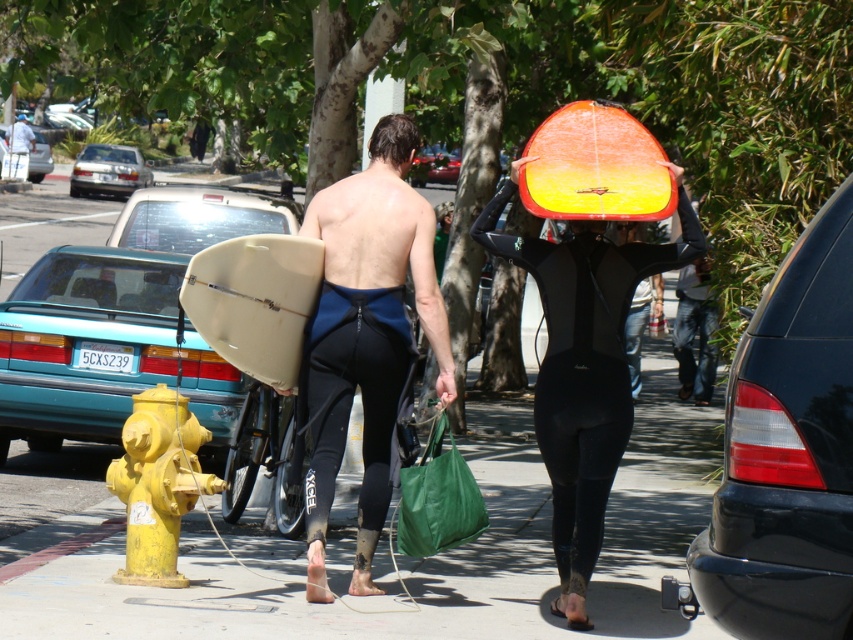
From the picture: You are a photographer trying to capture both the matte black wetsuit at center and the shiny orange surfboard at upper center in a single shot. Given their sizes, which object should you focus on to ensure both are clearly visible in your frame?

The matte black wetsuit at center is bigger than the shiny orange surfboard at upper center, so focusing on the matte black wetsuit at center will help ensure both objects are clearly visible in the frame.

You are a photographer trying to capture both the yellow painted fire hydrant at lower left and the brown matte hair at center in a single frame. Based on their sizes in the image, which object would appear taller?

The yellow painted fire hydrant at lower left appears taller than the brown matte hair at center in the image.